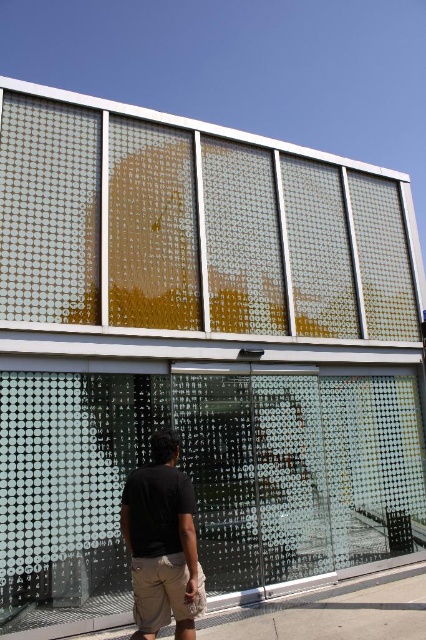
The image size is (426, 640). What are the coordinates of `black matte shirt at center` in the screenshot? It's located at coord(163,541).

Does point (135, 582) come closer to viewer compared to point (275, 605)?

That is True.

This screenshot has height=640, width=426. I want to click on black matte shirt at center, so click(163, 541).

Which of these two, transparent glass window at upper center or gray concrete pavement at lower center, stands shorter?

Standing shorter between the two is gray concrete pavement at lower center.

Who is lower down, transparent glass window at upper center or gray concrete pavement at lower center?

Positioned lower is gray concrete pavement at lower center.

Locate an element on the screen. transparent glass window at upper center is located at coordinates (195, 227).

The width and height of the screenshot is (426, 640). I want to click on transparent glass window at upper center, so click(195, 227).

The width and height of the screenshot is (426, 640). Describe the element at coordinates (195, 227) in the screenshot. I see `transparent glass window at upper center` at that location.

Which is behind, point (365, 298) or point (169, 508)?

Positioned behind is point (365, 298).

Locate an element on the screen. The image size is (426, 640). transparent glass window at upper center is located at coordinates (195, 227).

Find the location of a particular element. transparent glass window at upper center is located at coordinates (195, 227).